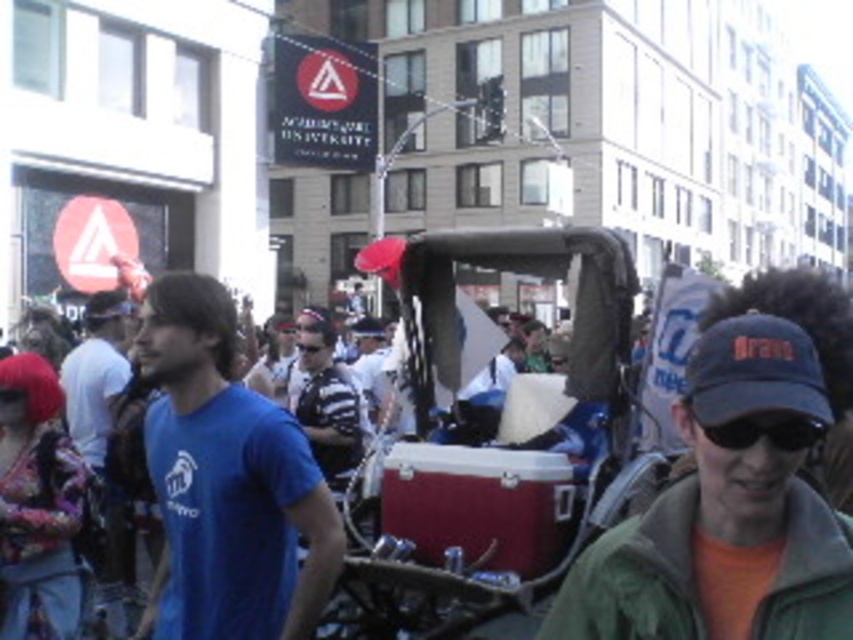
Question: In this image, where is blue matte t-shirt at center located relative to black matte cap at lower right?

Choices:
 (A) below
 (B) above

Answer: (A)

Question: Estimate the real-world distances between objects in this image. Which object is farther from the blue matte t-shirt at center?

Choices:
 (A) blue fabric baseball cap at lower right
 (B) black matte goggles at center

Answer: (B)

Question: Does metallic silver cart at center appear on the left side of striped shirt at center?

Choices:
 (A) yes
 (B) no

Answer: (B)

Question: Which object is closer to the camera taking this photo?

Choices:
 (A) green fuzzy jacket at lower right
 (B) black matte cap at lower right

Answer: (A)

Question: Which of these objects is positioned closest to the blue matte t-shirt at center?

Choices:
 (A) metallic silver cart at center
 (B) green fuzzy jacket at lower right
 (C) striped shirt at center
 (D) black matte cap at lower right

Answer: (A)

Question: From the image, what is the correct spatial relationship of metallic silver cart at center in relation to black matte goggles at center?

Choices:
 (A) right
 (B) left

Answer: (A)